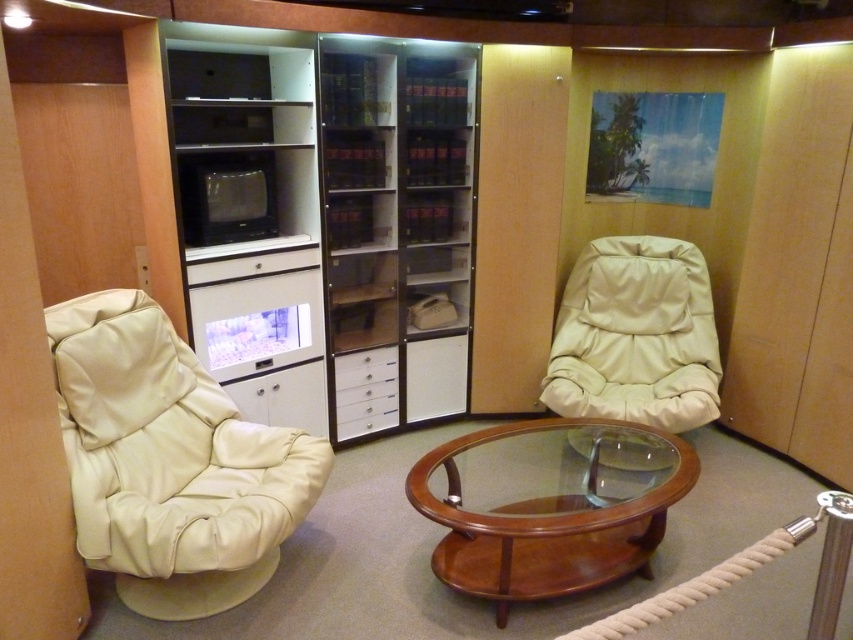
Question: Among these objects, which one is farthest from the camera?

Choices:
 (A) white glossy drawer at center
 (B) transparent plastic bookshelf at center
 (C) white leather swivel chair at left
 (D) mahogany glass coffee table at center

Answer: (A)

Question: Observing the image, what is the correct spatial positioning of transparent plastic bookshelf at center in reference to mahogany glass coffee table at center?

Choices:
 (A) right
 (B) left

Answer: (B)

Question: Estimate the real-world distances between objects in this image. Which object is farther from the transparent plastic bookshelf at center?

Choices:
 (A) white leather swivel chair at left
 (B) mahogany glass coffee table at center
 (C) beige leather swivel chair at center
 (D) white glossy drawer at center

Answer: (B)

Question: Estimate the real-world distances between objects in this image. Which object is closer to the white leather swivel chair at left?

Choices:
 (A) white glossy drawer at center
 (B) mahogany glass coffee table at center
 (C) transparent plastic bookshelf at center
 (D) beige leather swivel chair at center

Answer: (B)

Question: Does transparent plastic bookshelf at center appear on the left side of beige leather swivel chair at center?

Choices:
 (A) yes
 (B) no

Answer: (A)

Question: Is mahogany glass coffee table at center positioned in front of beige leather swivel chair at center?

Choices:
 (A) no
 (B) yes

Answer: (B)